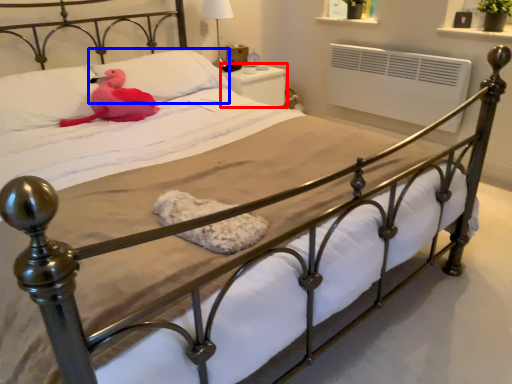
Question: Which object is further to the camera taking this photo, nightstand (highlighted by a red box) or pillow (highlighted by a blue box)?

Choices:
 (A) nightstand
 (B) pillow

Answer: (A)